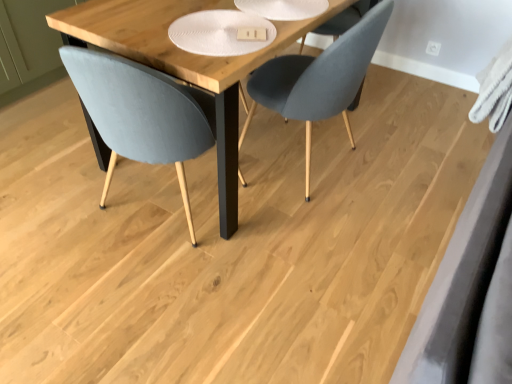
Question: Considering their positions, is matte gray chair at left, which is the second chair from right to left, located in front of or behind velvet grey chair at center, the first chair in the right-to-left sequence?

Choices:
 (A) behind
 (B) front

Answer: (B)

Question: From a real-world perspective, is matte gray chair at left, which is the second chair from right to left, above or below velvet grey chair at center, the first chair in the right-to-left sequence?

Choices:
 (A) below
 (B) above

Answer: (B)

Question: Considering the real-world distances, which object is farthest from the wooden table at center?

Choices:
 (A) matte gray chair at left, which is counted as the first chair, starting from the left
 (B) velvet grey chair at center, acting as the second chair starting from the left

Answer: (B)

Question: Which of these objects is positioned closest to the velvet grey chair at center, the first chair in the right-to-left sequence?

Choices:
 (A) wooden table at center
 (B) matte gray chair at left, which is the second chair from right to left

Answer: (A)